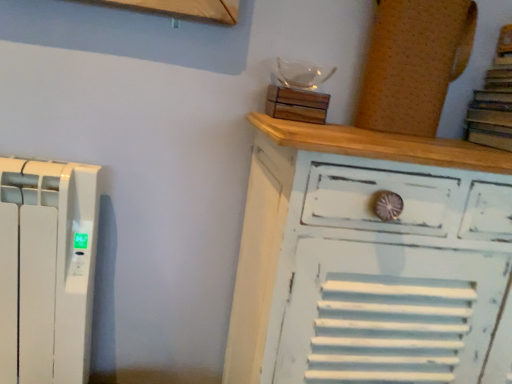
Question: Is white distressed wood chest of drawers at upper right turned away from brown paper book at upper right?

Choices:
 (A) no
 (B) yes

Answer: (A)

Question: Is white distressed wood chest of drawers at upper right at the left side of brown paper book at upper right?

Choices:
 (A) no
 (B) yes

Answer: (B)

Question: Can you confirm if white distressed wood chest of drawers at upper right is smaller than brown paper book at upper right?

Choices:
 (A) no
 (B) yes

Answer: (A)

Question: Does white distressed wood chest of drawers at upper right lie in front of brown paper book at upper right?

Choices:
 (A) yes
 (B) no

Answer: (A)

Question: Can you confirm if white distressed wood chest of drawers at upper right is thinner than brown paper book at upper right?

Choices:
 (A) yes
 (B) no

Answer: (B)

Question: From a real-world perspective, is white distressed wood chest of drawers at upper right physically above brown paper book at upper right?

Choices:
 (A) yes
 (B) no

Answer: (B)

Question: Can you confirm if brown paper book at upper right is wider than white distressed wood chest of drawers at upper right?

Choices:
 (A) no
 (B) yes

Answer: (A)

Question: From the image's perspective, is brown paper book at upper right beneath white distressed wood chest of drawers at upper right?

Choices:
 (A) yes
 (B) no

Answer: (B)

Question: Is brown paper book at upper right looking in the opposite direction of white distressed wood chest of drawers at upper right?

Choices:
 (A) no
 (B) yes

Answer: (A)

Question: Considering the relative sizes of brown paper book at upper right and white distressed wood chest of drawers at upper right in the image provided, is brown paper book at upper right bigger than white distressed wood chest of drawers at upper right?

Choices:
 (A) no
 (B) yes

Answer: (A)

Question: Considering the relative sizes of brown paper book at upper right and white distressed wood chest of drawers at upper right in the image provided, is brown paper book at upper right shorter than white distressed wood chest of drawers at upper right?

Choices:
 (A) yes
 (B) no

Answer: (A)

Question: Is the surface of brown paper book at upper right in direct contact with white distressed wood chest of drawers at upper right?

Choices:
 (A) yes
 (B) no

Answer: (B)

Question: Can you confirm if white distressed wood chest of drawers at upper right is smaller than cork board at upper right, which is the first wood from right to left?

Choices:
 (A) yes
 (B) no

Answer: (B)